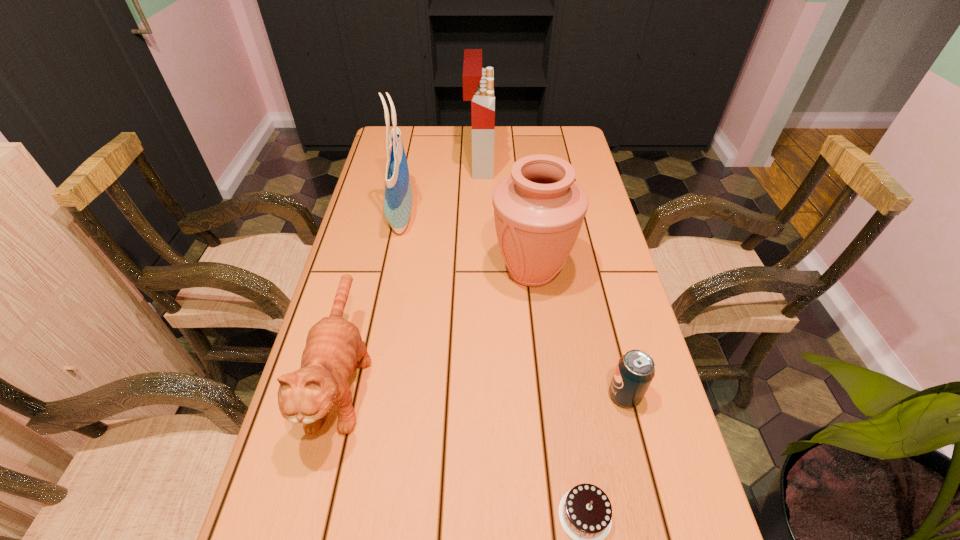
Locate an element on the screen. The width and height of the screenshot is (960, 540). tote bag is located at coordinates (398, 193).

Where is `cigarette case`? The image size is (960, 540). cigarette case is located at coordinates (478, 83).

The width and height of the screenshot is (960, 540). Identify the location of vase. (539, 209).

Find the location of a particular element. The width and height of the screenshot is (960, 540). the third shortest object is located at coordinates (334, 348).

Identify the location of the rightmost object. point(635,371).

You are a GUI agent. You are given a task and a screenshot of the screen. Output one action in this format:
    pyautogui.click(x=<x>, y=<y>)
    Task: Click on the second shortest object
    The height and width of the screenshot is (540, 960).
    Given the screenshot: What is the action you would take?
    pyautogui.click(x=635, y=371)

Image resolution: width=960 pixels, height=540 pixels. I want to click on vacant space located on the right of the tote bag, so click(x=440, y=215).

I want to click on vacant point located 0.180m with the lid open on the farthest object, so click(x=543, y=163).

Where is `free region located 0.070m on the right of the vase`? free region located 0.070m on the right of the vase is located at coordinates (599, 271).

Identify the location of free space located 0.100m on the face of the third shortest object. This screenshot has height=540, width=960. (308, 518).